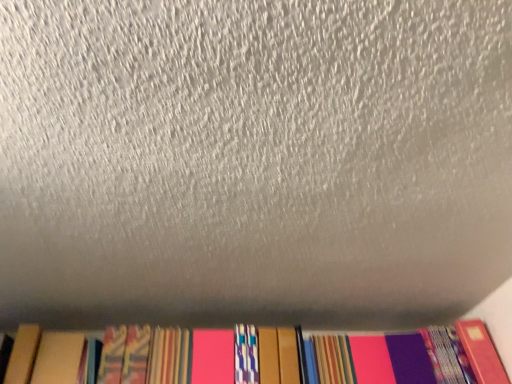
Question: Should I look upward or downward to see hardcover book at bottom left?

Choices:
 (A) up
 (B) down

Answer: (B)